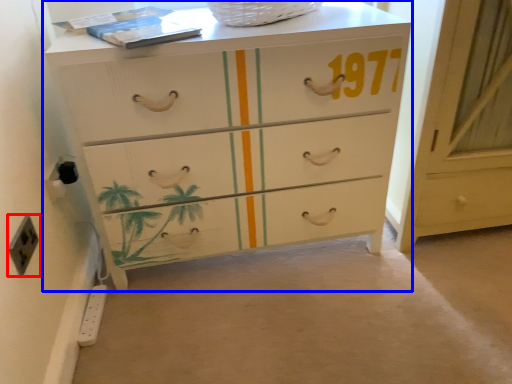
Question: Which point is further to the camera, electric outlet (highlighted by a red box) or chest of drawers (highlighted by a blue box)?

Choices:
 (A) electric outlet
 (B) chest of drawers

Answer: (B)